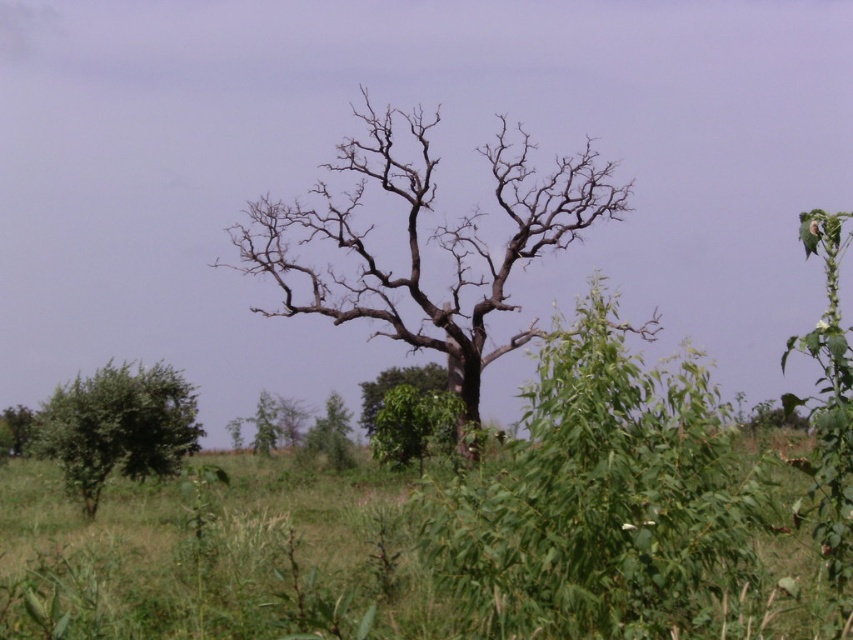
Between brown/dry wood tree at center and green leafy tree at center, which one has more height?

brown/dry wood tree at center

Which is more to the right, brown/dry wood tree at center or green leafy tree at center?

From the viewer's perspective, brown/dry wood tree at center appears more on the right side.

Which is behind, point (341, 276) or point (434, 384)?

The point (434, 384) is more distant.

I want to click on brown/dry wood tree at center, so [428, 241].

Is green leafy shrub at lower left to the left of green leafy tree at center from the viewer's perspective?

Indeed, green leafy shrub at lower left is positioned on the left side of green leafy tree at center.

What do you see at coordinates (119, 426) in the screenshot? The height and width of the screenshot is (640, 853). I see `green leafy shrub at lower left` at bounding box center [119, 426].

Is point (164, 433) in front of point (416, 374)?

Yes, point (164, 433) is closer to viewer.

Locate an element on the screen. Image resolution: width=853 pixels, height=640 pixels. green leafy shrub at lower left is located at coordinates (119, 426).

How distant is brown/dry wood tree at center from green leafy shrub at lower left?

A distance of 17.14 meters exists between brown/dry wood tree at center and green leafy shrub at lower left.

Is point (387, 120) farther from camera compared to point (136, 461)?

That is True.

Between point (529, 256) and point (109, 413), which one is positioned behind?

Positioned behind is point (529, 256).

Find the location of a particular element. This screenshot has width=853, height=640. brown/dry wood tree at center is located at coordinates (428, 241).